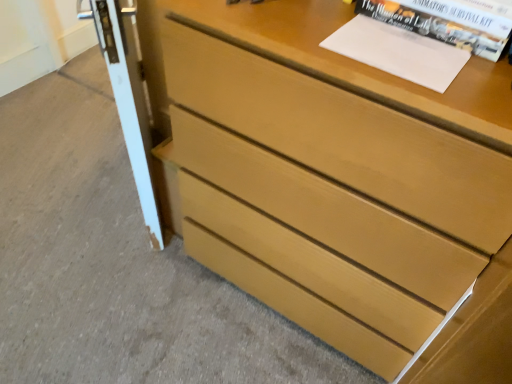
Find the location of a particular element. This screenshot has height=384, width=512. unoccupied region to the right of white paper at upper right is located at coordinates (474, 60).